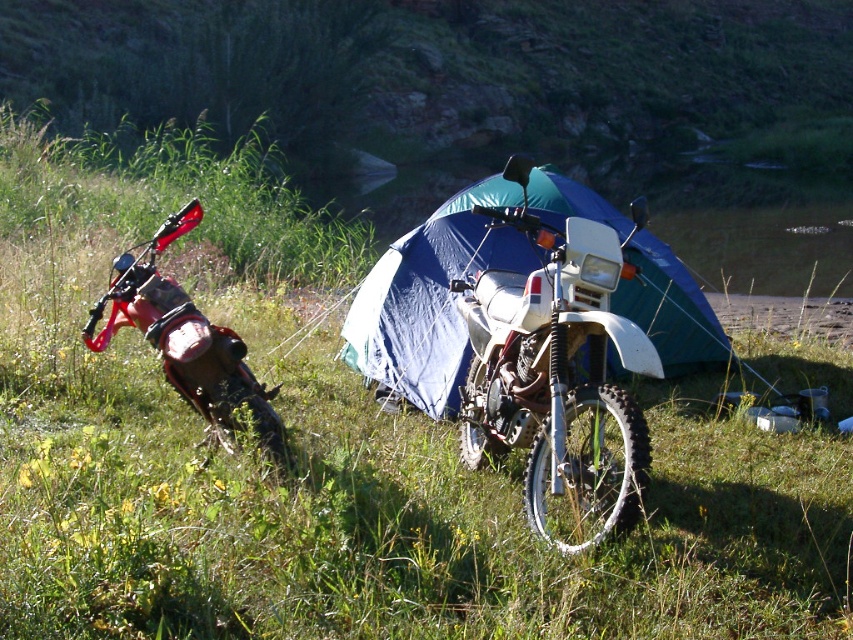
Consider the image. You are planning to transport both the white matte motorcycle at center and the blue fabric tent at center in a truck bed that is 2 meters wide. Can both items fit side by side without exceeding the truck bed width?

The white matte motorcycle at center is narrower than the blue fabric tent at center. However, since the combined width of both items would be more than the truck bed width of 2 meters, they cannot fit side by side.

You are planning to transport both the white matte motorcycle at center and the brushed metal motorcycle at left in a truck. The truck bed can only accommodate one motorcycle at a time. Based on their sizes, which motorcycle should you load first to ensure the second one fits in the remaining space?

The white matte motorcycle at center is bigger than the brushed metal motorcycle at left. Therefore, you should load the white matte motorcycle at center first to ensure there is enough space left for the smaller brushed metal motorcycle at left.